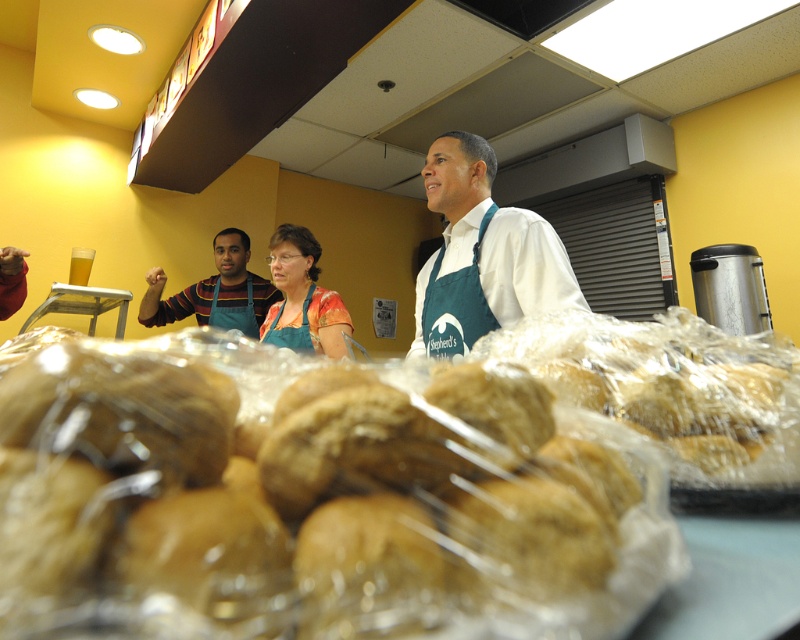
Does golden brown bread at center appear over white matte apron at upper center?

Incorrect, golden brown bread at center is not positioned above white matte apron at upper center.

Identify the location of golden brown bread at center. This screenshot has height=640, width=800. (362, 483).

Between point (10, 625) and point (566, 268), which one is positioned in front?

Point (10, 625) is in front.

Find the location of a particular element. The height and width of the screenshot is (640, 800). golden brown bread at center is located at coordinates click(362, 483).

Is white matte apron at upper center bigger than matte green apron at center?

Indeed, white matte apron at upper center has a larger size compared to matte green apron at center.

Does white matte apron at upper center come in front of matte green apron at center?

Yes, white matte apron at upper center is closer to the viewer.

Does point (498, 276) come farther from viewer compared to point (329, 340)?

No, (498, 276) is closer to viewer.

The height and width of the screenshot is (640, 800). What are the coordinates of `white matte apron at upper center` in the screenshot? It's located at (482, 253).

Is golden brown bread at center to the right of matte blue apron at center from the viewer's perspective?

Correct, you'll find golden brown bread at center to the right of matte blue apron at center.

Who is taller, golden brown bread at center or matte blue apron at center?

matte blue apron at center

Is point (588, 323) behind point (240, 307)?

That is False.

Where is `golden brown bread at center`? This screenshot has height=640, width=800. golden brown bread at center is located at coordinates (362, 483).